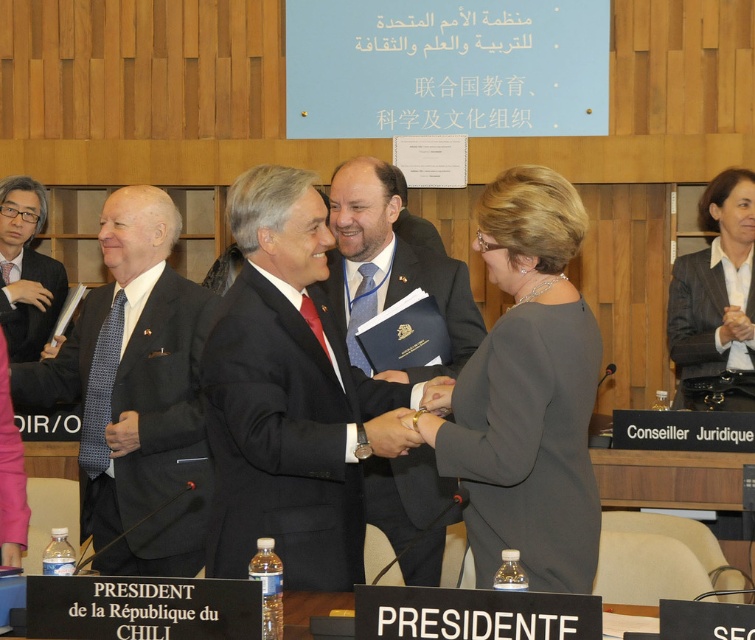
Question: Which point is closer to the camera?

Choices:
 (A) dark gray wool suit at left
 (B) dark gray suit at left
 (C) black satin suit at center
 (D) black satin business suit at right

Answer: (C)

Question: In this image, where is black satin suit at center located relative to dark gray wool suit at center?

Choices:
 (A) right
 (B) left

Answer: (B)

Question: Does dark gray wool suit at left have a smaller size compared to dark gray wool suit at center?

Choices:
 (A) yes
 (B) no

Answer: (B)

Question: Which is farther from the dark gray wool suit at left?

Choices:
 (A) dark gray suit at left
 (B) dark gray suit at center
 (C) dark gray wool suit at center

Answer: (A)

Question: Does black satin suit at center have a lesser width compared to black satin business suit at right?

Choices:
 (A) no
 (B) yes

Answer: (A)

Question: Considering the real-world distances, which object is closest to the dark gray suit at left?

Choices:
 (A) dark gray suit at center
 (B) dark gray wool suit at left

Answer: (B)